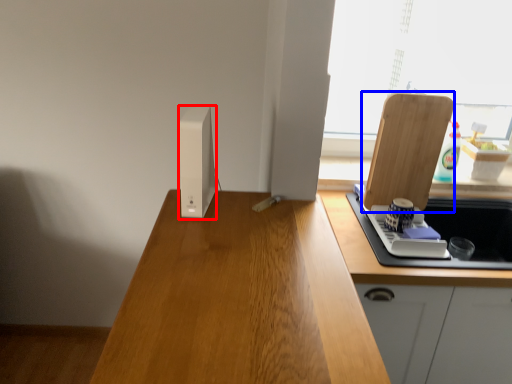
Question: Which object is closer to the camera taking this photo, appliance (highlighted by a red box) or cutting board (highlighted by a blue box)?

Choices:
 (A) appliance
 (B) cutting board

Answer: (A)